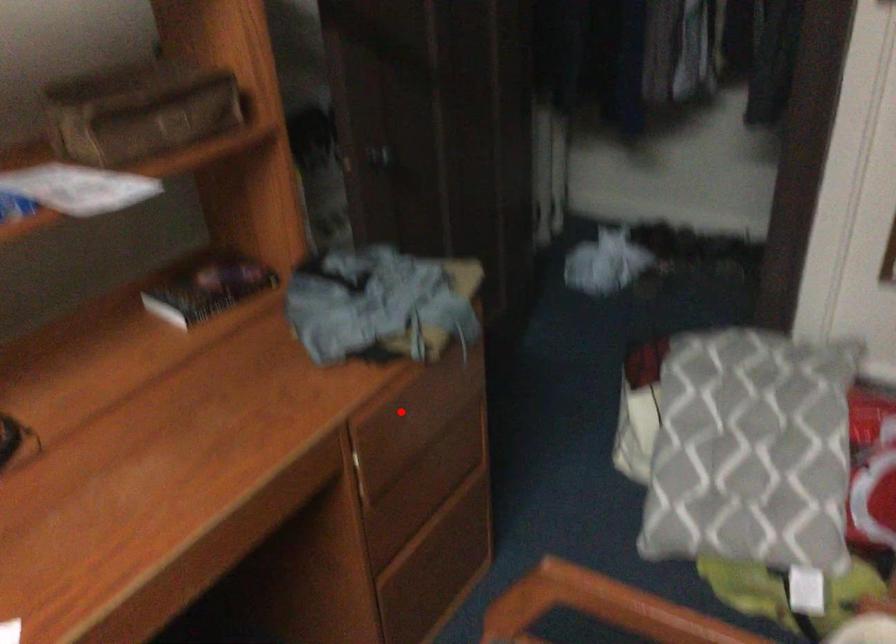
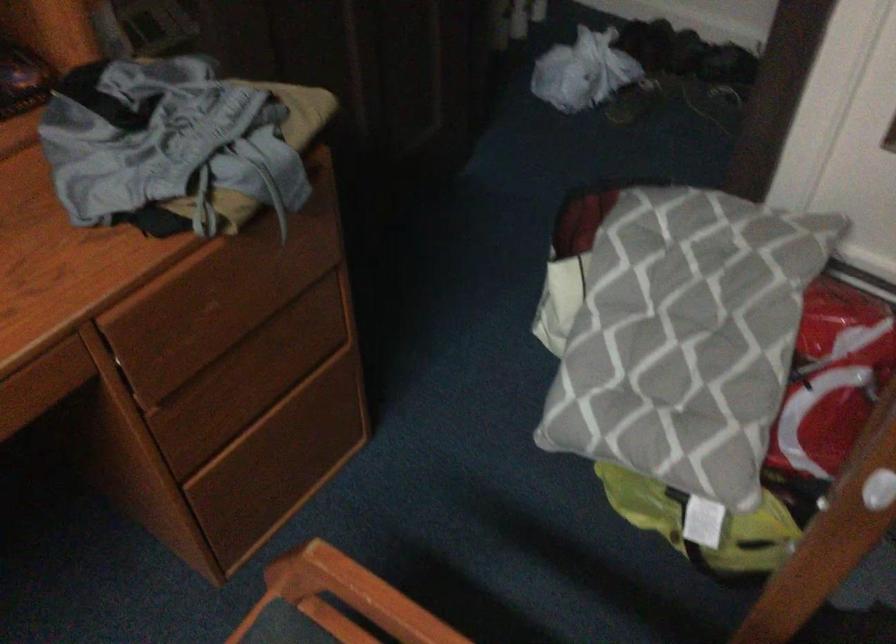
Where in the second image is the point corresponding to the highlighted location from the first image?

(196, 294)